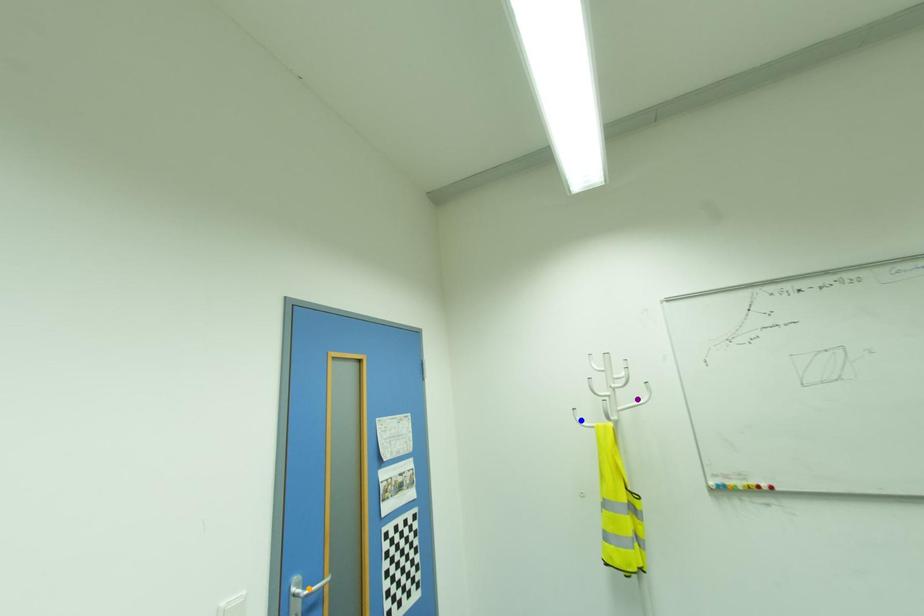
Order these from nearest to farthest:
A) orange point
B) purple point
C) blue point

orange point < purple point < blue point